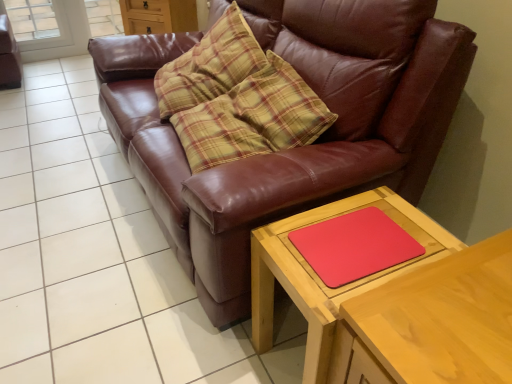
What do you see at coordinates (297, 148) in the screenshot?
I see `brown leather couch at center` at bounding box center [297, 148].

Locate an element on the screen. brown leather couch at center is located at coordinates (297, 148).

The width and height of the screenshot is (512, 384). What do you see at coordinates (158, 16) in the screenshot?
I see `matte brown dresser at upper center` at bounding box center [158, 16].

This screenshot has width=512, height=384. Describe the element at coordinates (319, 271) in the screenshot. I see `wooden table at lower right, which is counted as the 2th table, starting from the right` at that location.

What are the coordinates of `wooden table at lower right, placed as the second table when sorted from left to right` in the screenshot? It's located at (433, 323).

The width and height of the screenshot is (512, 384). I want to click on rubberized red mouse pad at lower right, so click(354, 246).

Is rubberized red mouse pad at lower right far from matte brown dresser at upper center?

Yes, rubberized red mouse pad at lower right and matte brown dresser at upper center are located far from each other.

In the scene shown: From a real-world perspective, is rubberized red mouse pad at lower right on top of matte brown dresser at upper center?

Yes.

What's the angular difference between rubberized red mouse pad at lower right and matte brown dresser at upper center's facing directions?

rubberized red mouse pad at lower right and matte brown dresser at upper center are facing 38 degrees away from each other.

Between point (15, 62) and point (178, 24), which one is positioned behind?

Positioned behind is point (15, 62).

Locate an element on the screen. This screenshot has width=512, height=384. swivel chair on the left of the matte brown dresser at upper center is located at coordinates (9, 56).

Does matte brown swivel chair at upper left have a greater height compared to matte brown dresser at upper center?

Correct, matte brown swivel chair at upper left is much taller as matte brown dresser at upper center.

Does point (384, 224) lie behind point (273, 275)?

No, (384, 224) is in front of (273, 275).

From a real-world perspective, is rubberized red mouse pad at lower right under wooden table at lower right, the first table positioned from the left?

No.

Is rubberized red mouse pad at lower right closer to camera compared to wooden table at lower right, the first table positioned from the left?

No, the depth of rubberized red mouse pad at lower right is greater than that of wooden table at lower right, the first table positioned from the left.

From the image's perspective, relative to wooden table at lower right, the first table positioned from the left, is rubberized red mouse pad at lower right above or below?

Based on their image positions, rubberized red mouse pad at lower right is located above wooden table at lower right, the first table positioned from the left.

From a real-world perspective, is wooden table at lower right, which is the 1th table from right to left, located beneath rubberized red mouse pad at lower right?

Correct, in the physical world, wooden table at lower right, which is the 1th table from right to left, is lower than rubberized red mouse pad at lower right.

How different are the orientations of wooden table at lower right, which is the 1th table from right to left, and rubberized red mouse pad at lower right in degrees?

There is a 0.125-degree angle between the facing directions of wooden table at lower right, which is the 1th table from right to left, and rubberized red mouse pad at lower right.

Could rubberized red mouse pad at lower right be considered to be inside wooden table at lower right, which is the 1th table from right to left?

No, rubberized red mouse pad at lower right is not a part of wooden table at lower right, which is the 1th table from right to left.

Locate an element on the screen. The height and width of the screenshot is (384, 512). the 2nd table in front of the rubberized red mouse pad at lower right, counting from the anchor's position is located at coordinates (433, 323).

Relative to brown leather couch at center, is matte brown dresser at upper center in front or behind?

matte brown dresser at upper center is behind brown leather couch at center.

From a real-world perspective, is matte brown dresser at upper center under brown leather couch at center?

Indeed, from a real-world perspective, matte brown dresser at upper center is positioned beneath brown leather couch at center.

Can you tell me how much matte brown dresser at upper center and brown leather couch at center differ in facing direction?

37 degrees separate the facing orientations of matte brown dresser at upper center and brown leather couch at center.

Is matte brown dresser at upper center positioned beyond the bounds of brown leather couch at center?

Yes.

Which object is positioned more to the right, brown leather couch at center or matte brown dresser at upper center?

Positioned to the right is brown leather couch at center.

Is brown leather couch at center turned away from matte brown dresser at upper center?

brown leather couch at center does not have its back to matte brown dresser at upper center.

Can you confirm if brown leather couch at center is bigger than matte brown dresser at upper center?

Yes.

From the image's perspective, is brown leather couch at center positioned above or below matte brown dresser at upper center?

Clearly, from the image's perspective, brown leather couch at center is below matte brown dresser at upper center.

Is wooden table at lower right, the first table positioned from the left, further to the viewer compared to matte brown swivel chair at upper left?

No, wooden table at lower right, the first table positioned from the left, is closer to the viewer.

Considering the sizes of objects wooden table at lower right, the first table positioned from the left, and matte brown swivel chair at upper left in the image provided, who is thinner, wooden table at lower right, the first table positioned from the left, or matte brown swivel chair at upper left?

Thinner between the two is wooden table at lower right, the first table positioned from the left.

Which of these two, wooden table at lower right, which is counted as the 2th table, starting from the right, or matte brown swivel chair at upper left, is bigger?

With larger size is wooden table at lower right, which is counted as the 2th table, starting from the right.

Identify the location of flat below the matte brown dresser at upper center (from the image's perspective). (354, 246).

Identify the location of dresser above the matte brown swivel chair at upper left (from the image's perspective). (158, 16).

Based on their spatial positions, is rubberized red mouse pad at lower right or brown leather couch at center closer to wooden table at lower right, which is counted as the 2th table, starting from the right?

rubberized red mouse pad at lower right lies closer to wooden table at lower right, which is counted as the 2th table, starting from the right, than the other object.

Looking at the image, which one is located further to wooden table at lower right, placed as the second table when sorted from left to right, matte brown dresser at upper center or brown leather couch at center?

matte brown dresser at upper center is positioned further to the anchor wooden table at lower right, placed as the second table when sorted from left to right.

Based on their spatial positions, is wooden table at lower right, which is counted as the 2th table, starting from the right, or rubberized red mouse pad at lower right closer to matte brown dresser at upper center?

wooden table at lower right, which is counted as the 2th table, starting from the right, is closer to matte brown dresser at upper center.

Which object lies nearer to the anchor point wooden table at lower right, the first table positioned from the left, rubberized red mouse pad at lower right or matte brown swivel chair at upper left?

Based on the image, rubberized red mouse pad at lower right appears to be nearer to wooden table at lower right, the first table positioned from the left.

Which object lies nearer to the anchor point wooden table at lower right, which is the 1th table from right to left, matte brown dresser at upper center or matte brown swivel chair at upper left?

Among the two, matte brown dresser at upper center is located nearer to wooden table at lower right, which is the 1th table from right to left.

Considering their positions, is matte brown swivel chair at upper left positioned closer to matte brown dresser at upper center than brown leather couch at center?

The object closer to matte brown dresser at upper center is matte brown swivel chair at upper left.

When comparing their distances from matte brown dresser at upper center, does matte brown swivel chair at upper left or wooden table at lower right, the first table positioned from the left, seem closer?

matte brown swivel chair at upper left.

From the image, which object appears to be farther from wooden table at lower right, which is counted as the 2th table, starting from the right, matte brown dresser at upper center or matte brown swivel chair at upper left?

matte brown swivel chair at upper left.

The width and height of the screenshot is (512, 384). In order to click on swivel chair between rubberized red mouse pad at lower right and matte brown dresser at upper center along the z-axis in this screenshot , I will do `click(9, 56)`.

Image resolution: width=512 pixels, height=384 pixels. In order to click on studio couch positioned between wooden table at lower right, which is the 1th table from right to left, and matte brown dresser at upper center from near to far in this screenshot , I will do `click(297, 148)`.

Find the location of a particular element. This screenshot has height=384, width=512. flat between wooden table at lower right, which is the 1th table from right to left, and matte brown dresser at upper center in the front-back direction is located at coordinates (354, 246).

The height and width of the screenshot is (384, 512). I want to click on flat between matte brown swivel chair at upper left and wooden table at lower right, the first table positioned from the left, so click(354, 246).